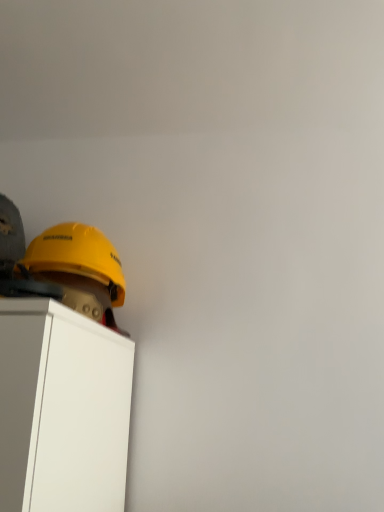
Image resolution: width=384 pixels, height=512 pixels. Identify the location of yellow matte helmet at upper left. (77, 255).

Measure the distance between point (122, 290) and camera.

Point (122, 290) and camera are 36.77 inches apart.

Describe the element at coordinates (77, 255) in the screenshot. I see `yellow matte helmet at upper left` at that location.

Find the location of a particular element. The height and width of the screenshot is (512, 384). yellow matte helmet at upper left is located at coordinates tap(77, 255).